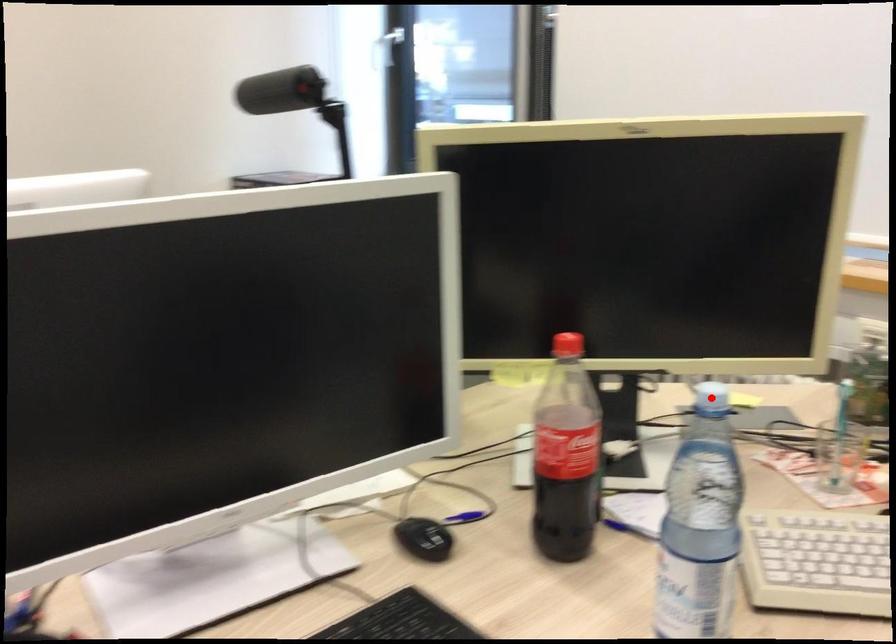
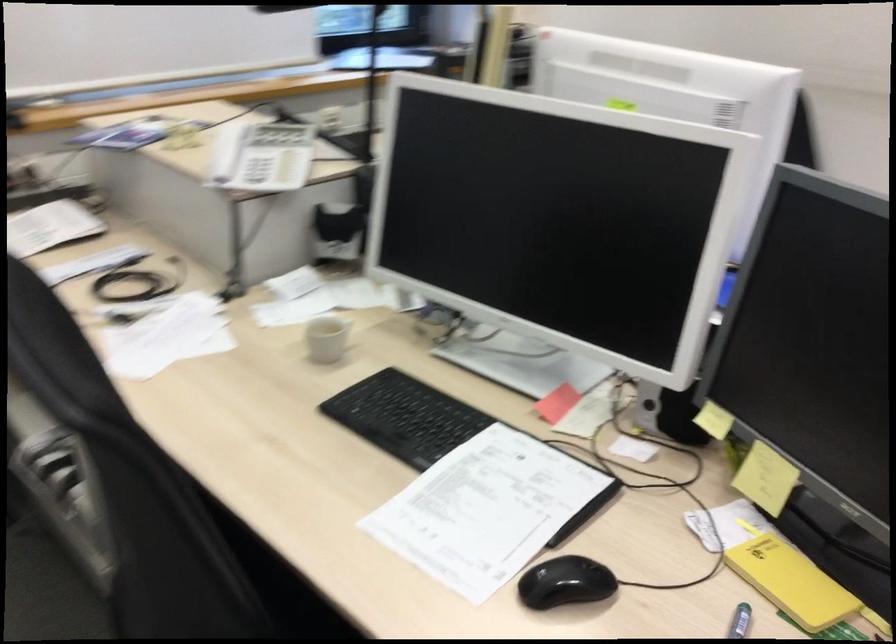
Question: I am providing you with two images of the same scene from different viewpoints. A red point is marked on the first image. Is the red point's position out of view in image 2?

Choices:
 (A) Yes
 (B) No

Answer: (A)